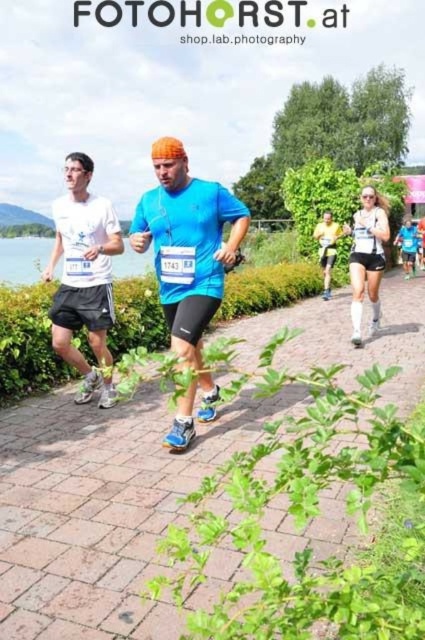
Does brick pavement at center appear on the right side of yellow fabric at center?

Incorrect, brick pavement at center is not on the right side of yellow fabric at center.

Is brick pavement at center above yellow fabric at center?

No, brick pavement at center is not above yellow fabric at center.

Is point (84, 560) positioned before point (323, 211)?

Yes, it is.

Identify the location of brick pavement at center. (320, 324).

Between brick pavement at center and matte white shorts at center, which one is positioned lower?

Positioned lower is brick pavement at center.

Between point (5, 508) and point (357, 275), which one is positioned in front?

Positioned in front is point (5, 508).

Is point (340, 344) closer to camera compared to point (350, 257)?

Yes, it is in front of point (350, 257).

At what (x,y) coordinates should I click in order to perform the action: click on brick pavement at center. Please return your answer as a coordinate pair (x, y). This screenshot has width=425, height=640. Looking at the image, I should click on (320, 324).

Does matte blue shirt at center have a lesser height compared to brick pavement at center?

Indeed, matte blue shirt at center has a lesser height compared to brick pavement at center.

Measure the distance between matte blue shirt at center and camera.

A distance of 3.94 meters exists between matte blue shirt at center and camera.

Is point (204, 396) in front of point (334, 317)?

Yes, it is.

I want to click on matte blue shirt at center, so click(187, 264).